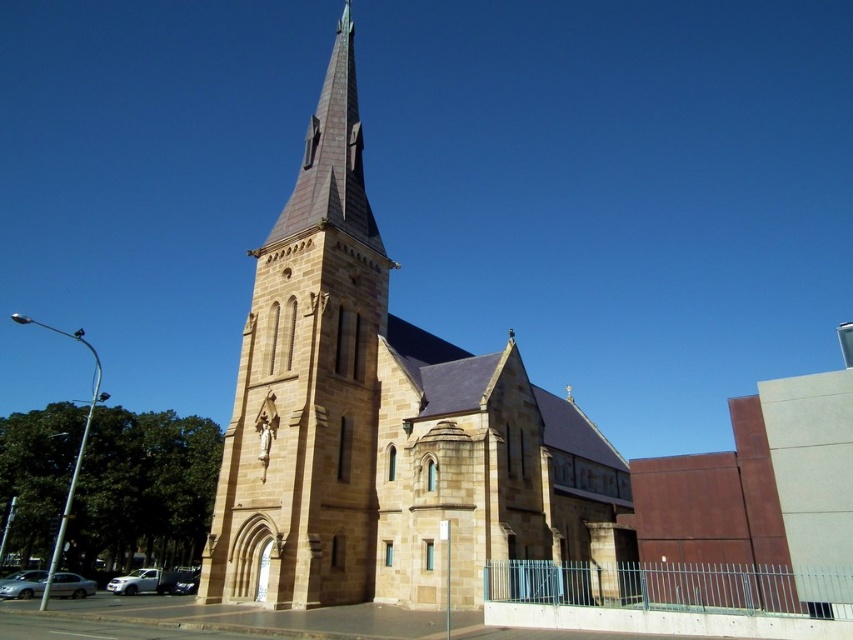
Question: Which of the following is the farthest from the observer?

Choices:
 (A) (339, 147)
 (B) (381, 314)

Answer: (A)

Question: Which of the following is the closest to the observer?

Choices:
 (A) (222, 465)
 (B) (434, 440)

Answer: (B)

Question: Can you confirm if brown stone church at center is positioned above brown stone tower at center?

Choices:
 (A) no
 (B) yes

Answer: (A)

Question: Which point is farther to the camera?

Choices:
 (A) brown stone tower at center
 (B) brown stone church at center

Answer: (A)

Question: Observing the image, what is the correct spatial positioning of brown stone church at center in reference to brown stone tower at center?

Choices:
 (A) above
 (B) below

Answer: (B)

Question: Is brown stone church at center bigger than brown stone tower at center?

Choices:
 (A) no
 (B) yes

Answer: (B)